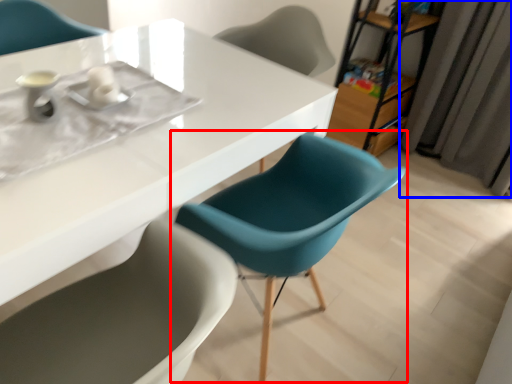
Question: Among these objects, which one is nearest to the camera, chair (highlighted by a red box) or curtain (highlighted by a blue box)?

Choices:
 (A) chair
 (B) curtain

Answer: (A)